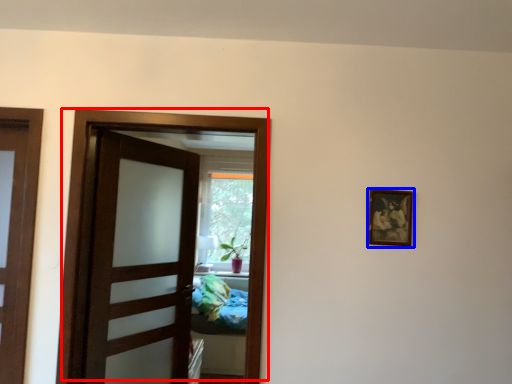
Question: Which object appears closest to the camera in this image, door (highlighted by a red box) or picture frame (highlighted by a blue box)?

Choices:
 (A) door
 (B) picture frame

Answer: (A)